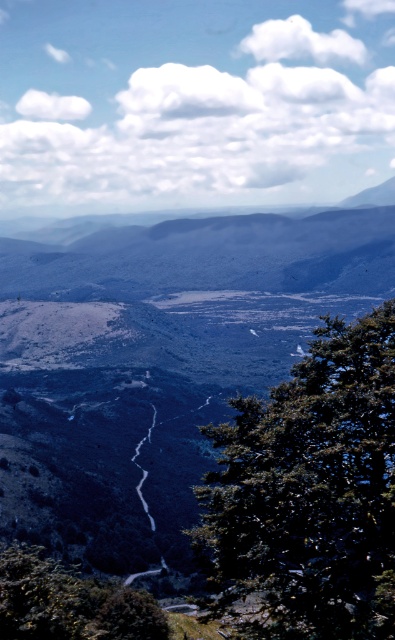
You are an environmental scientist studying the distribution of tree sizes in this mountain valley. Given the presence of the green leafy tree at center and the green leafy tree at lower left, which tree would you hypothesize has a greater capacity to provide shade, and why?

The green leafy tree at center has a greater capacity to provide shade because it is larger in size than the green leafy tree at lower left.

You are a hiker planning to set up a tent between the green leafy tree at center and the green leafy tree at lower left. Considering their widths, which tree should you avoid placing the tent closer to if you want more space around your tent?

You should avoid placing the tent closer to the green leafy tree at center because its width is less than the green leafy tree at lower left, meaning the latter offers more space around it.